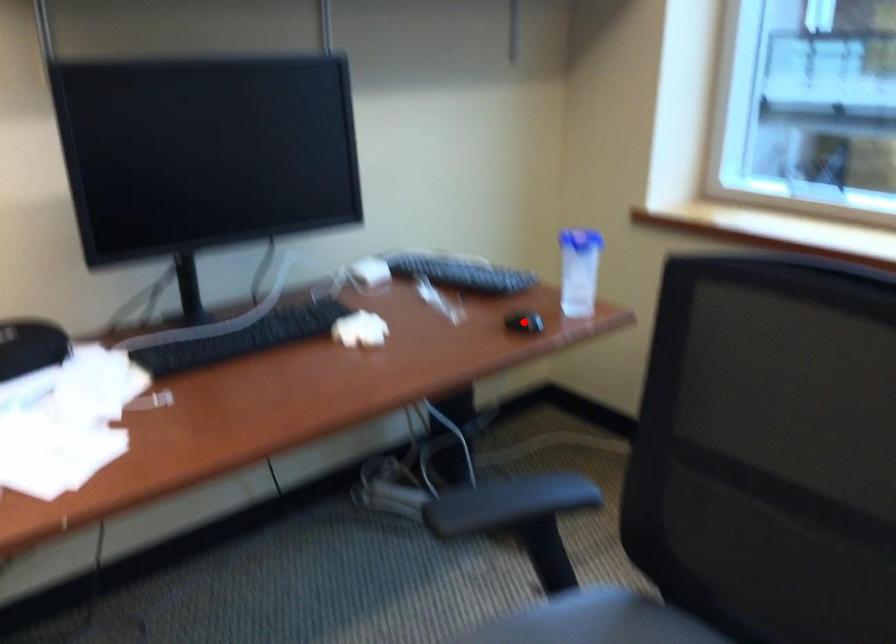
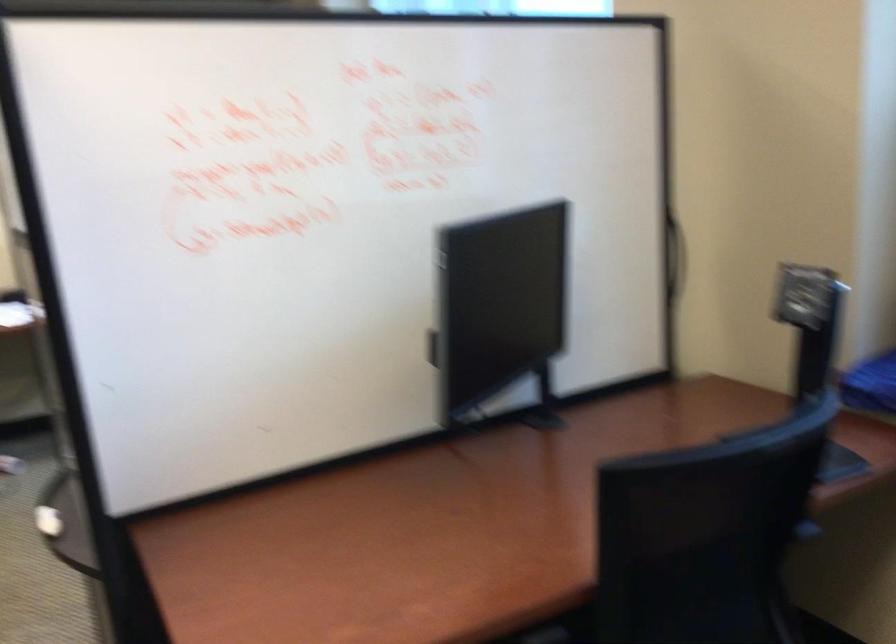
Question: I am providing you with two images of the same scene from different viewpoints. A red point is marked on the first image. Is the red point's position out of view in image 2?

Choices:
 (A) Yes
 (B) No

Answer: (A)